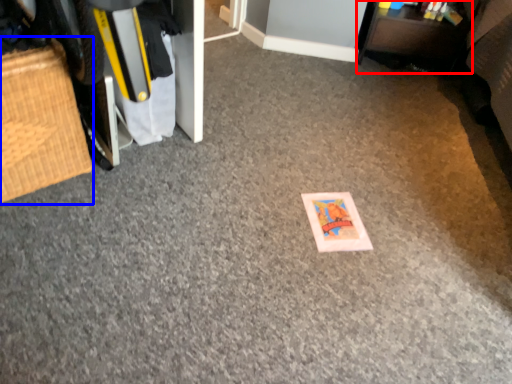
Question: Which object is further to the camera taking this photo, furniture (highlighted by a red box) or furniture (highlighted by a blue box)?

Choices:
 (A) furniture
 (B) furniture

Answer: (A)